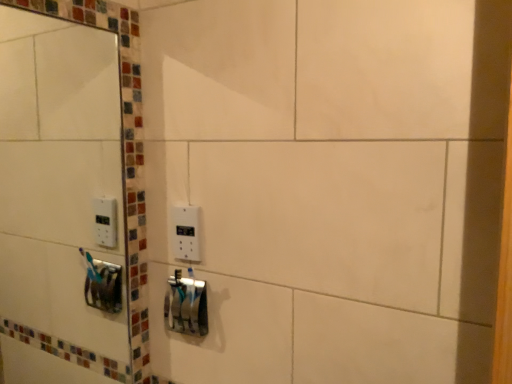
Question: From a real-world perspective, is white plastic light switch at center above or below white glossy mirror at upper left?

Choices:
 (A) above
 (B) below

Answer: (B)

Question: Is white plastic light switch at center bigger or smaller than white glossy mirror at upper left?

Choices:
 (A) big
 (B) small

Answer: (B)

Question: Which of these objects is positioned farthest from the white plastic light switch at center?

Choices:
 (A) metallic silver toothbrush holder at center
 (B) white glossy mirror at upper left

Answer: (B)

Question: Estimate the real-world distances between objects in this image. Which object is farther from the white glossy mirror at upper left?

Choices:
 (A) metallic silver toothbrush holder at center
 (B) white plastic light switch at center

Answer: (B)